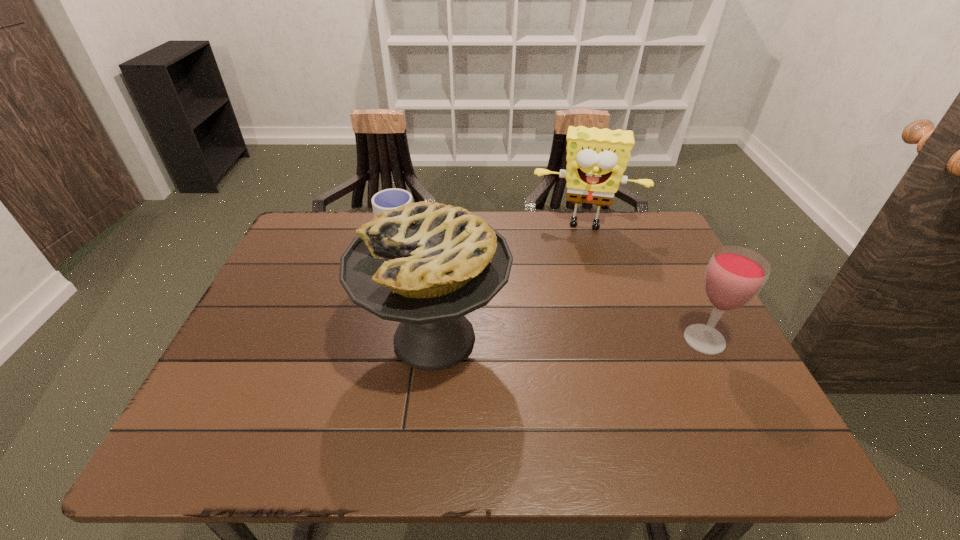
In order to click on vacant point that satisfies the following two spatial constraints: 1. on the front side of the shortest object; 2. on the cut side of the pie in this screenshot , I will do `click(379, 338)`.

You are a GUI agent. You are given a task and a screenshot of the screen. Output one action in this format:
    pyautogui.click(x=<x>, y=<y>)
    Task: Click on the free space that satisfies the following two spatial constraints: 1. on the front side of the wineglass; 2. on the left side of the sponge
    This screenshot has height=540, width=960.
    Given the screenshot: What is the action you would take?
    pyautogui.click(x=622, y=340)